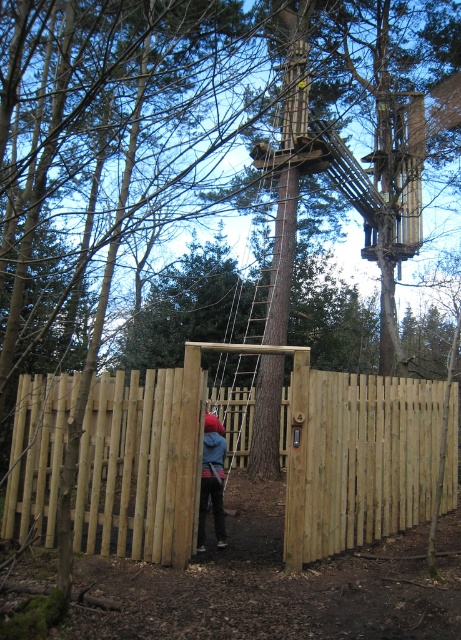
Does point (395, 433) lie in front of point (217, 458)?

No, it is behind (217, 458).

Does light brown wooden gate at center have a greater width compared to blue denim jacket at center?

Correct, the width of light brown wooden gate at center exceeds that of blue denim jacket at center.

Locate an element on the screen. light brown wooden gate at center is located at coordinates (356, 458).